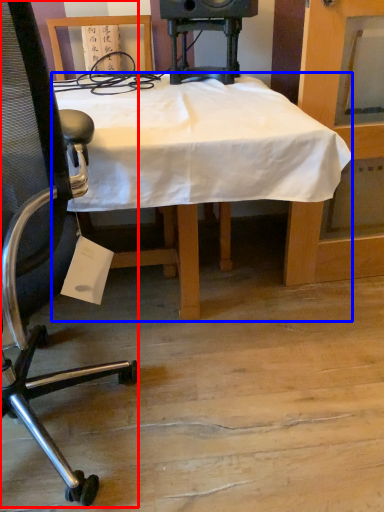
Question: Which object appears closest to the camera in this image, chair (highlighted by a red box) or desk (highlighted by a blue box)?

Choices:
 (A) chair
 (B) desk

Answer: (A)